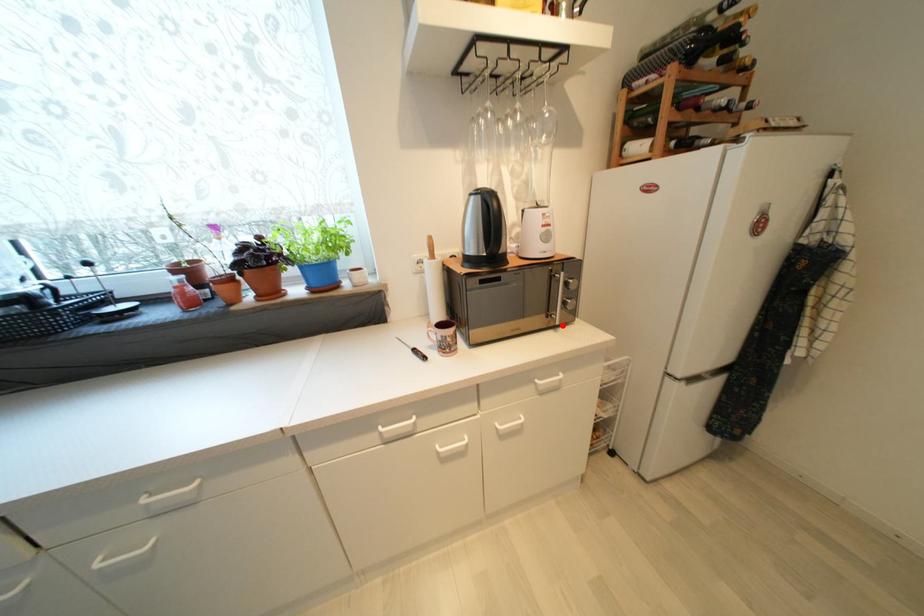
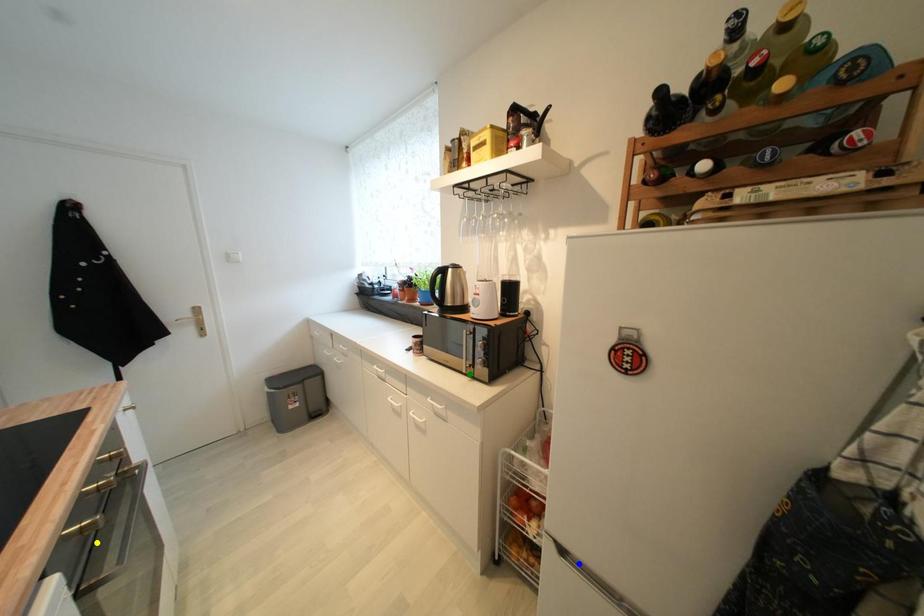
Question: I am providing you with two images of the same scene from different viewpoints. A red point is marked on the first image. You are given multiple points on the second image. Which point in image 2 represents the same 3d spot as the red point in image 1?

Choices:
 (A) yellow point
 (B) blue point
 (C) green point

Answer: (C)